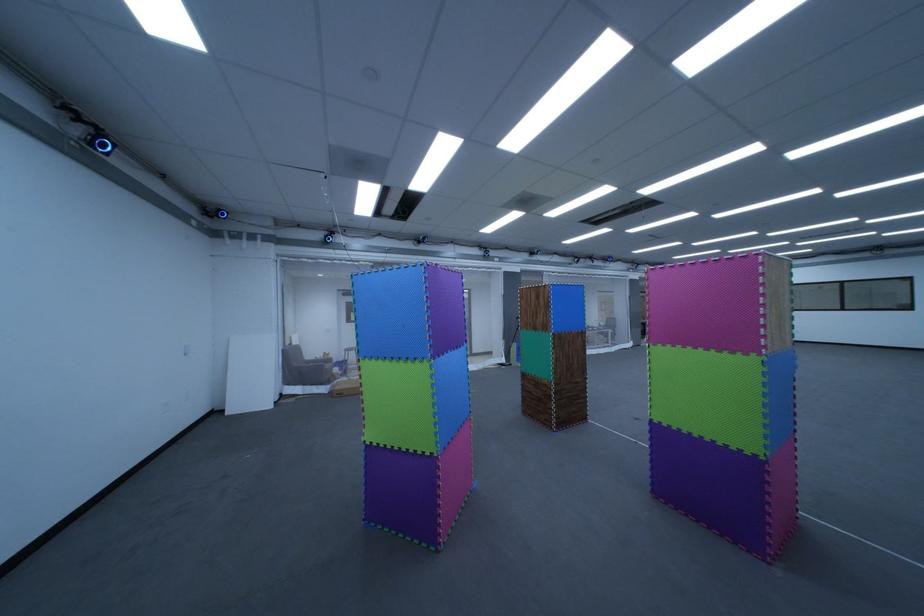
Describe the element at coordinates (345, 387) in the screenshot. The width and height of the screenshot is (924, 616). I see `the cardboard box` at that location.